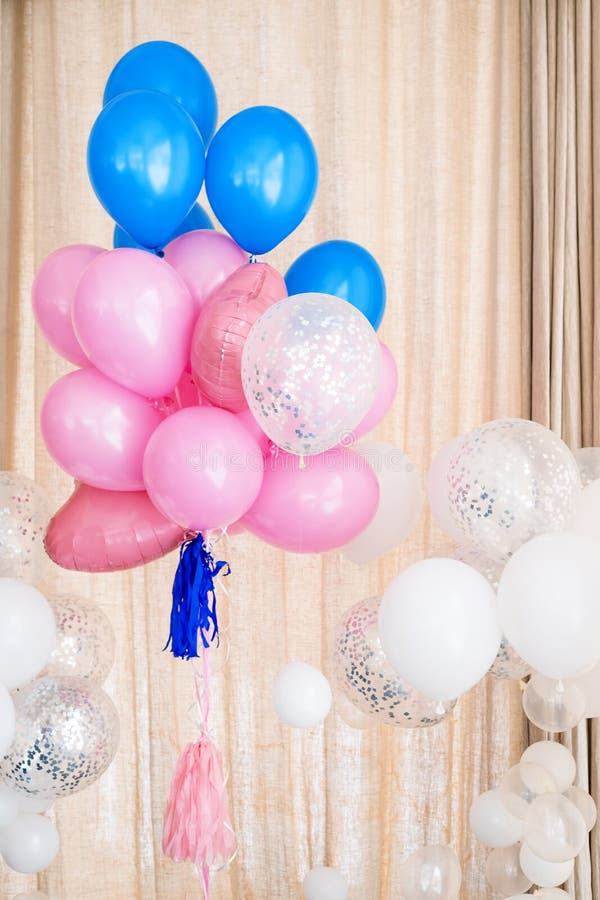
Where is `gold curtains`? Image resolution: width=600 pixels, height=900 pixels. gold curtains is located at coordinates (278, 605).